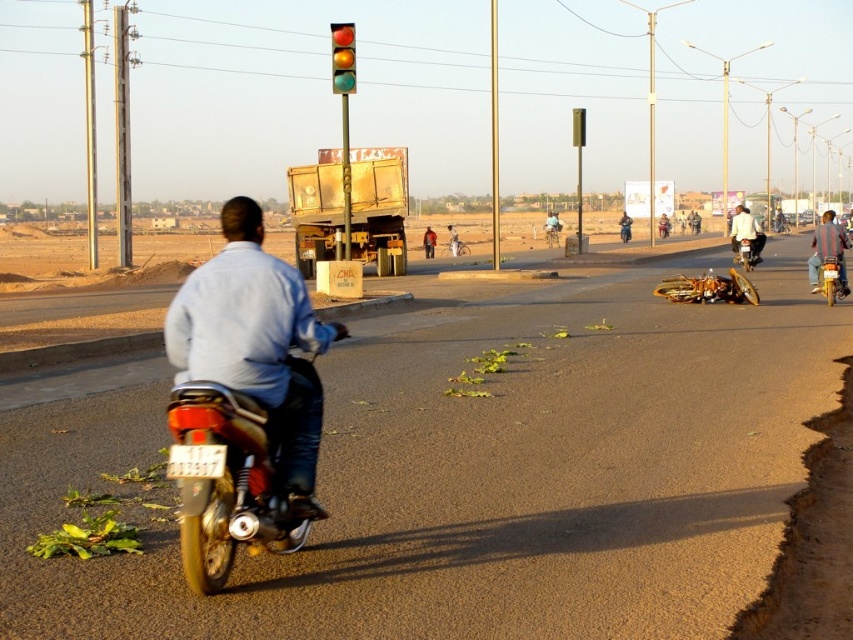
You are a pedestrian standing at the edge of the road and see both the metallic rectangular traffic light at center and the metallic silver bicycle at center. Which object is positioned to the right when viewed from your perspective?

The metallic rectangular traffic light at center is to the right of the metallic silver bicycle at center.

You are standing on the road and see two motorcycles, the metallic silver motorcycle at right and the brushed metal motorcycle at center. Which motorcycle is positioned to the right side of the other?

The metallic silver motorcycle at right is positioned to the right of the brushed metal motorcycle at center.